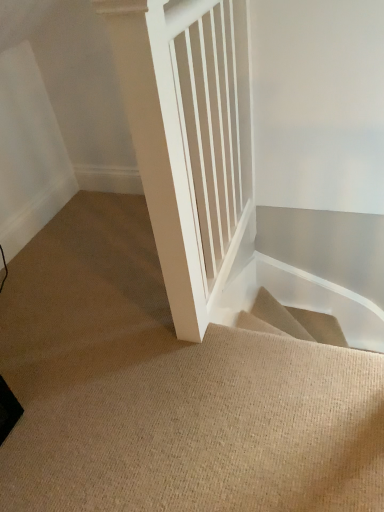
Question: Considering the positions of beige carpeted stairs at center and white smooth wooden pillar at center in the image, is beige carpeted stairs at center wider or thinner than white smooth wooden pillar at center?

Choices:
 (A) wide
 (B) thin

Answer: (A)

Question: Considering the positions of beige carpeted stairs at center and white smooth wooden pillar at center in the image, is beige carpeted stairs at center bigger or smaller than white smooth wooden pillar at center?

Choices:
 (A) small
 (B) big

Answer: (A)

Question: From their relative heights in the image, would you say beige carpeted stairs at center is taller or shorter than white smooth wooden pillar at center?

Choices:
 (A) short
 (B) tall

Answer: (A)

Question: From a real-world perspective, is white smooth wooden pillar at center above or below beige carpeted stairs at center?

Choices:
 (A) below
 (B) above

Answer: (B)

Question: Is white smooth wooden pillar at center in front of or behind beige carpeted stairs at center in the image?

Choices:
 (A) front
 (B) behind

Answer: (A)

Question: Looking at the image, does white smooth wooden pillar at center seem bigger or smaller compared to beige carpeted stairs at center?

Choices:
 (A) small
 (B) big

Answer: (B)

Question: Considering the positions of point (165, 268) and point (82, 425), is point (165, 268) closer or farther from the camera than point (82, 425)?

Choices:
 (A) closer
 (B) farther

Answer: (B)